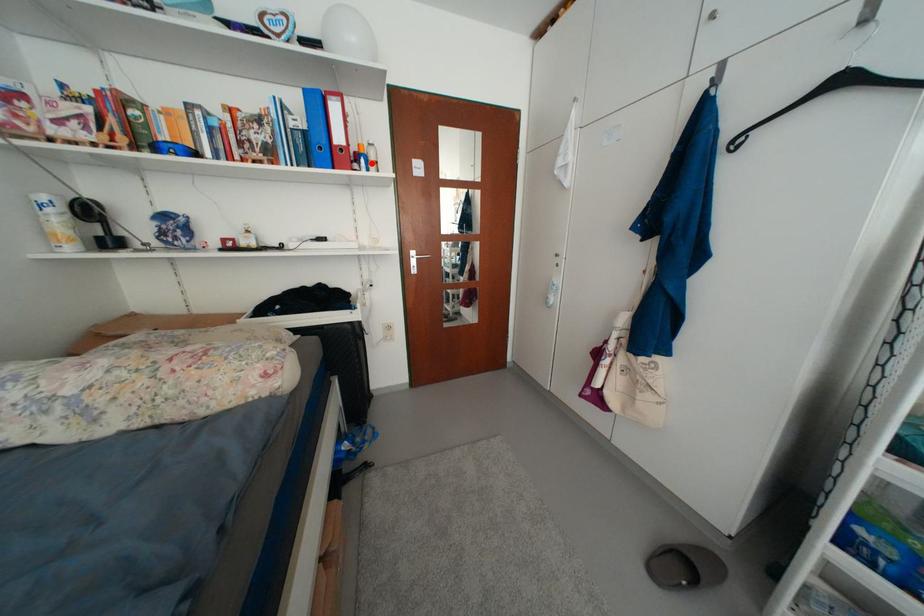
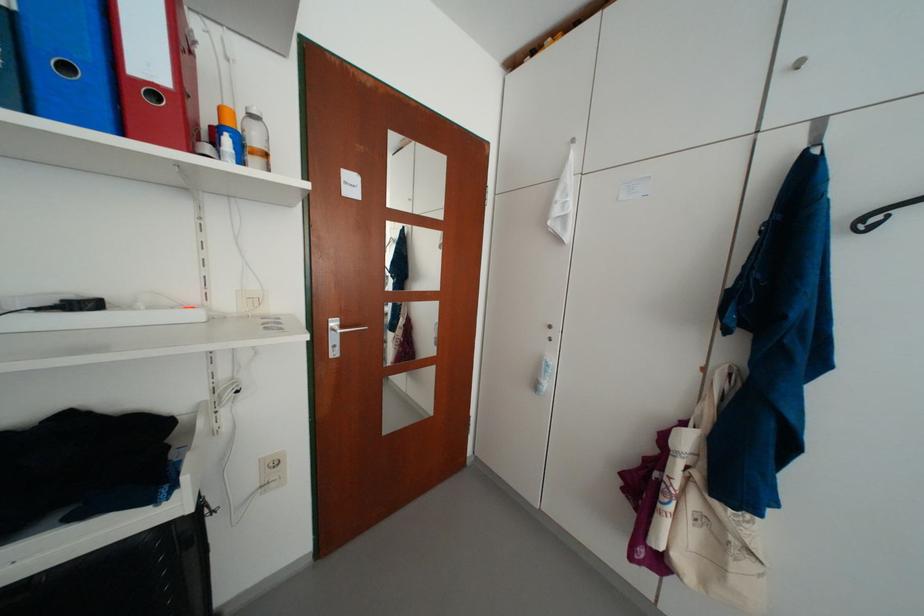
The point at the highlighted location is marked in the first image. Where is the corresponding point in the second image?

(236, 143)